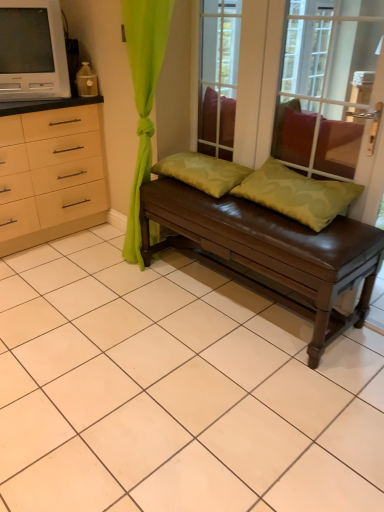
Question: Does transparent glass window screen at upper center have a smaller size compared to matte white television at upper left?

Choices:
 (A) yes
 (B) no

Answer: (A)

Question: Is transparent glass window screen at upper center at the right side of matte white television at upper left?

Choices:
 (A) yes
 (B) no

Answer: (A)

Question: Does transparent glass window screen at upper center have a greater height compared to matte white television at upper left?

Choices:
 (A) yes
 (B) no

Answer: (A)

Question: Is transparent glass window screen at upper center positioned before matte white television at upper left?

Choices:
 (A) no
 (B) yes

Answer: (B)

Question: Is transparent glass window screen at upper center looking in the opposite direction of matte white television at upper left?

Choices:
 (A) yes
 (B) no

Answer: (B)

Question: Considering the positions of brown leather bench at center and green matte pillow at center, which is the 1th pillow in right-to-left order, in the image, is brown leather bench at center wider or thinner than green matte pillow at center, which is the 1th pillow in right-to-left order,?

Choices:
 (A) thin
 (B) wide

Answer: (B)

Question: From a real-world perspective, is brown leather bench at center above or below green matte pillow at center, which is the second pillow from left to right?

Choices:
 (A) above
 (B) below

Answer: (B)

Question: Does point (158, 219) appear closer or farther from the camera than point (268, 190)?

Choices:
 (A) closer
 (B) farther

Answer: (B)

Question: Visually, is brown leather bench at center positioned to the left or to the right of green matte pillow at center, which is the second pillow from left to right?

Choices:
 (A) left
 (B) right

Answer: (A)

Question: Is brown leather bench at center bigger or smaller than green fabric pillow at center, which ranks as the 2th pillow in right-to-left order?

Choices:
 (A) big
 (B) small

Answer: (A)

Question: Is brown leather bench at center wider or thinner than green fabric pillow at center, which ranks as the 2th pillow in right-to-left order?

Choices:
 (A) thin
 (B) wide

Answer: (B)

Question: From the image's perspective, is brown leather bench at center located above or below green fabric pillow at center, which ranks as the 2th pillow in right-to-left order?

Choices:
 (A) below
 (B) above

Answer: (A)

Question: Would you say brown leather bench at center is inside or outside green fabric pillow at center, marked as the first pillow in a left-to-right arrangement?

Choices:
 (A) inside
 (B) outside

Answer: (B)

Question: Is point (220, 197) positioned closer to the camera than point (225, 250)?

Choices:
 (A) farther
 (B) closer

Answer: (A)

Question: Is green fabric pillow at center, marked as the first pillow in a left-to-right arrangement, in front of or behind brown leather bench at center in the image?

Choices:
 (A) behind
 (B) front

Answer: (A)